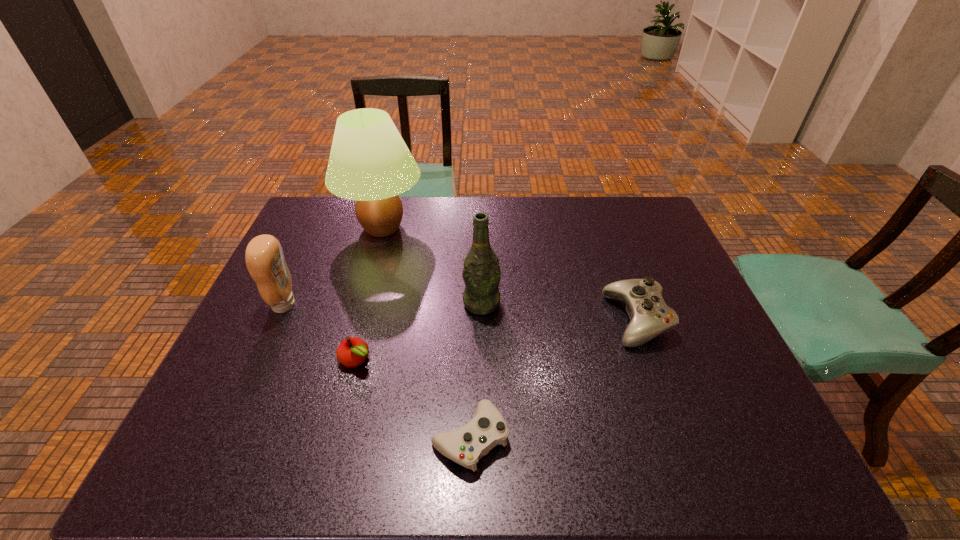
This screenshot has height=540, width=960. I want to click on vacant space that's between the lampshade and the shortest object, so click(x=426, y=333).

At what (x,y) coordinates should I click in order to perform the action: click on unoccupied position between the apple and the left control. Please return your answer as a coordinate pair (x, y). The image size is (960, 540). Looking at the image, I should click on (413, 399).

I want to click on free point between the lampshade and the apple, so [x=370, y=294].

Where is `vacant area that lies between the shorter control and the apple`? vacant area that lies between the shorter control and the apple is located at coordinates (413, 399).

The image size is (960, 540). I want to click on unoccupied position between the lampshade and the rightmost object, so click(x=510, y=274).

Image resolution: width=960 pixels, height=540 pixels. In order to click on empty location between the lampshade and the apple in this screenshot , I will do `click(370, 294)`.

The image size is (960, 540). I want to click on vacant region between the condiment and the farthest object, so [333, 266].

The width and height of the screenshot is (960, 540). In order to click on empty location between the beer bottle and the farthest object in this screenshot , I will do (432, 266).

This screenshot has width=960, height=540. In order to click on object that is the second nearest to the lampshade in this screenshot , I will do `click(481, 273)`.

The width and height of the screenshot is (960, 540). I want to click on the fifth closest object to the apple, so click(650, 316).